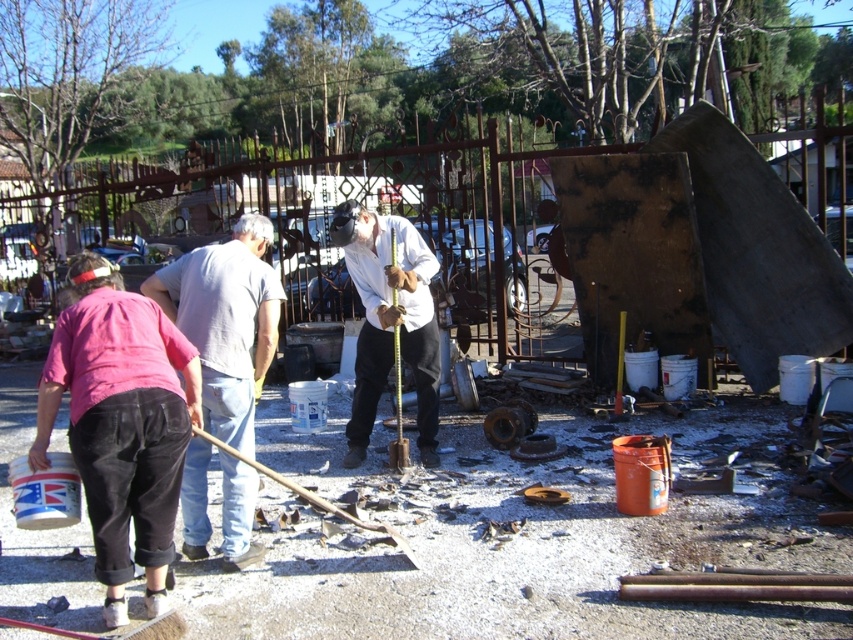
Which is behind, point (7, 365) or point (209, 307)?

The point (7, 365) is behind.

Does white matte cement at center come in front of gray cotton shirt at center?

No.

I want to click on white matte cement at center, so click(509, 540).

Which is above, white matte cement at center or white matte shirt at center?

white matte shirt at center

Is point (306, 589) positioned before point (418, 344)?

Yes, it is in front of point (418, 344).

Find the location of a particular element. white matte cement at center is located at coordinates (509, 540).

Image resolution: width=853 pixels, height=640 pixels. What do you see at coordinates (120, 422) in the screenshot? I see `pink fabric shirt at lower left` at bounding box center [120, 422].

Measure the distance between pink fabric shirt at lower left and gray cotton shirt at center.

A distance of 23.42 inches exists between pink fabric shirt at lower left and gray cotton shirt at center.

Locate an element on the screen. This screenshot has height=640, width=853. pink fabric shirt at lower left is located at coordinates (120, 422).